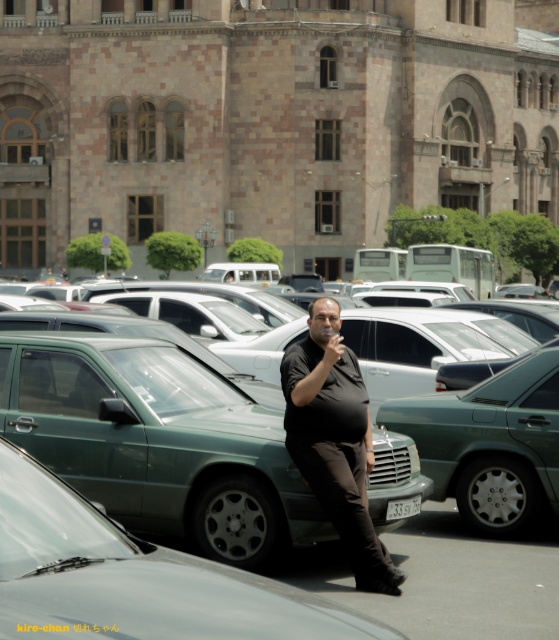
You are a delivery person who needs to place a package on the green matte car at center. However, there is a person wearing a black matte shirt at center in the way. Can you place the package on the car without moving the person?

The black matte shirt at center is positioned under the green matte car at center, meaning the person is directly beneath the car. Since the car is overhead, you can safely place the package on the car without disturbing the person as they are not blocking the access to the car.

You are a fashion designer observing the scene. You need to compare the width of the black matte shirt at center and the green matte car at center. Which one is wider?

The green matte car at center is wider than the black matte shirt at center.